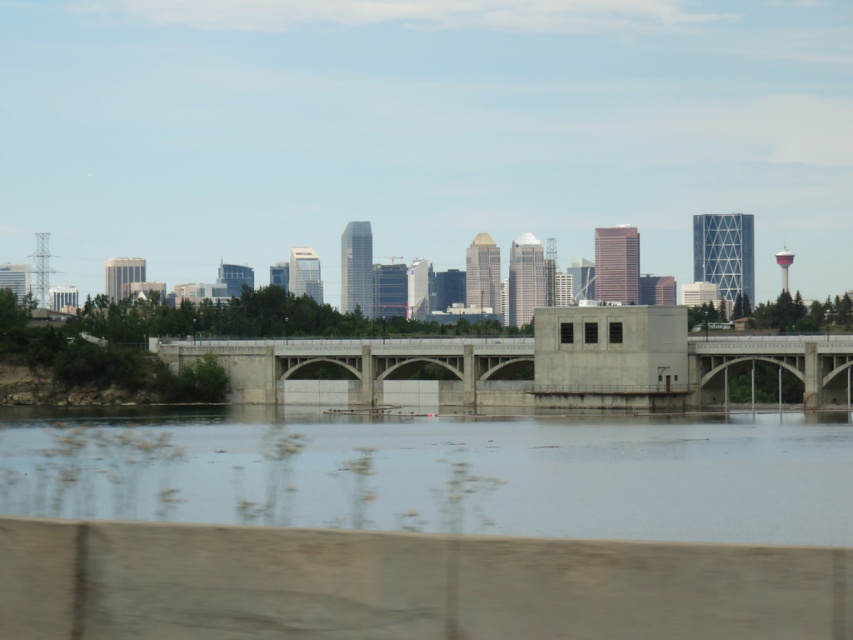
What are the coordinates of the clear water at center in the image?

The clear water at center is located at point (445,474).

You are a photographer planning to capture the city skyline reflected on the water. Given the clear water at center and the concrete bridge at center, which object will better reflect the skyline?

The clear water at center is taller than the concrete bridge at center, so it will better reflect the skyline because taller surfaces can provide a clearer and more complete reflection.